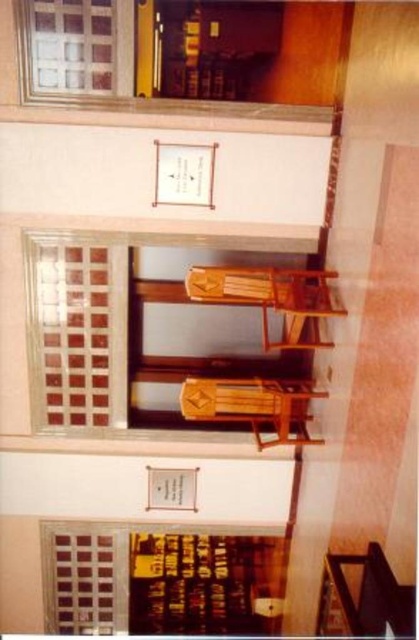
You are standing in the library and want to find the matte glass window at lower left. According to the scene description, where should you look relative to the central wooden structure?

The matte glass window at lower left is located at coordinates approximately 0.898 on the x axis and 0.368 on the y axis relative to the central wooden structure.

You are a delivery person trying to place a large package that is 2 meters tall. You see the matte glass window at lower left and the wooden bunk bed at center. Which object is taller and can the package fit vertically next to it?

The matte glass window at lower left is taller than the wooden bunk bed at center. Since the package is 2 meters tall, it can only fit next to the window if the window is at least 2 meters tall. However, the description only states the window is taller than the bunk bed but does not provide exact measurements, so we cannot confirm if it is tall enough for the package.

You are standing in the library and want to know how far you are from the point marked at coordinates point [155,602]. Can you determine the distance?

The point marked at coordinates point [155,602] is 11.95 meters away from you.